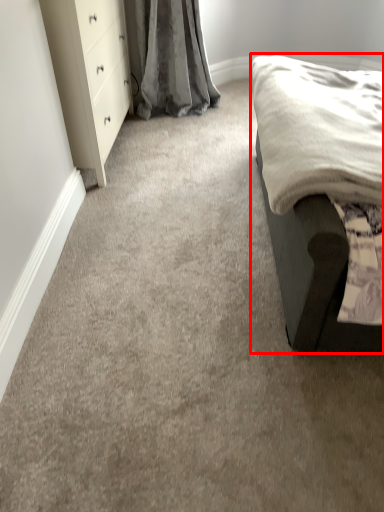
Question: From the image's perspective, where is furniture (annotated by the red box) located relative to chest of drawers?

Choices:
 (A) above
 (B) below

Answer: (B)